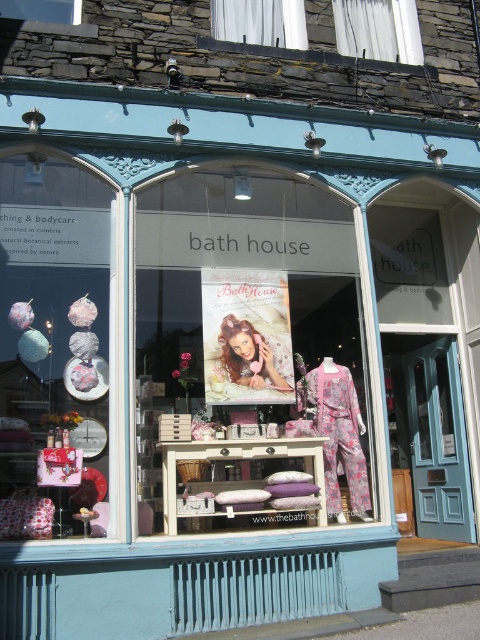
Question: Is the position of white fabric at upper center more distant than that of blonde hair at center?

Choices:
 (A) no
 (B) yes

Answer: (B)

Question: Can you confirm if white sheer curtain at upper center is positioned to the right of blonde hair at center?

Choices:
 (A) no
 (B) yes

Answer: (B)

Question: Which object appears farthest from the camera in this image?

Choices:
 (A) blonde hair at center
 (B) floral fabric pajamas at center
 (C) white sheer curtain at upper center
 (D) floral fabric dress at center

Answer: (C)

Question: Which of the following is the farthest from the observer?

Choices:
 (A) matte fabric hats at left
 (B) white sheer curtain at upper center
 (C) blonde hair at center
 (D) floral fabric dress at center

Answer: (B)

Question: Does matte fabric hats at left have a larger size compared to blonde hair at center?

Choices:
 (A) yes
 (B) no

Answer: (A)

Question: Considering the real-world distances, which object is closest to the floral fabric dress at center?

Choices:
 (A) white fabric at upper center
 (B) floral fabric pajamas at center
 (C) blonde hair at center

Answer: (C)